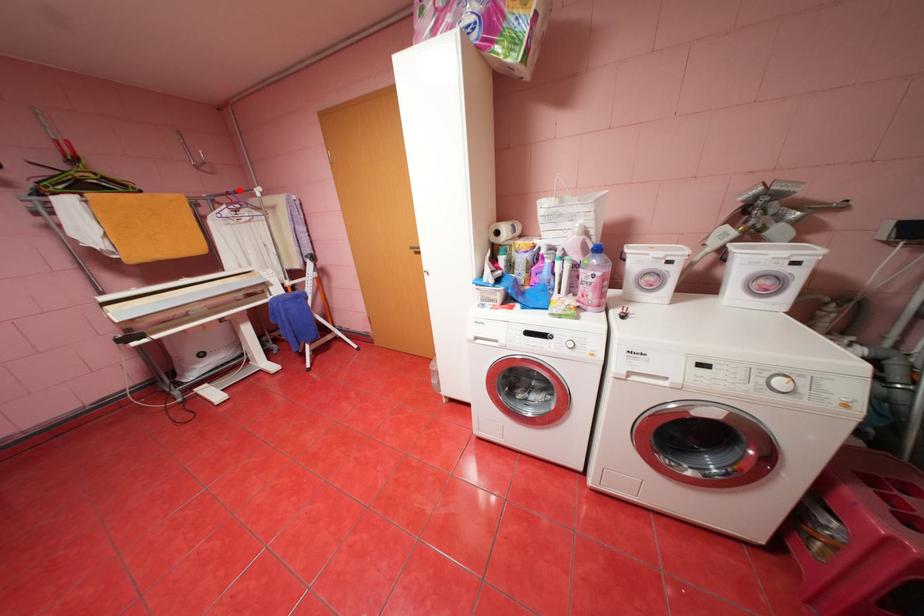
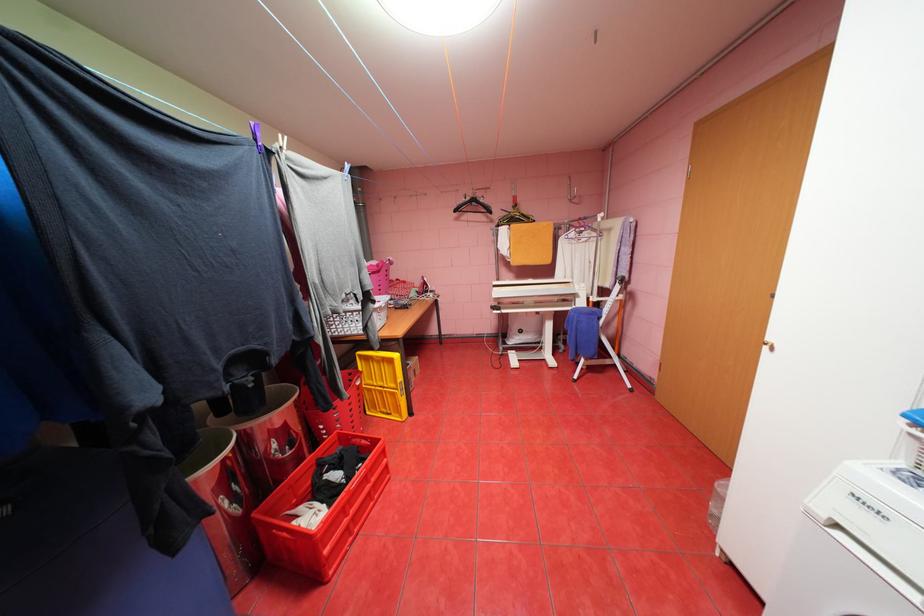
Find the pixel in the second image that matches the highlighted location in the first image.

(591, 216)